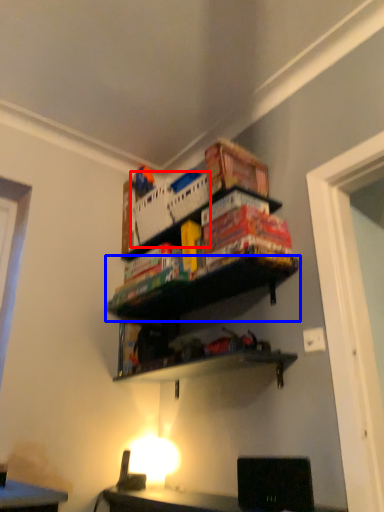
Question: Which point is closer to the camera, crate (highlighted by a red box) or shelf (highlighted by a blue box)?

Choices:
 (A) crate
 (B) shelf

Answer: (B)